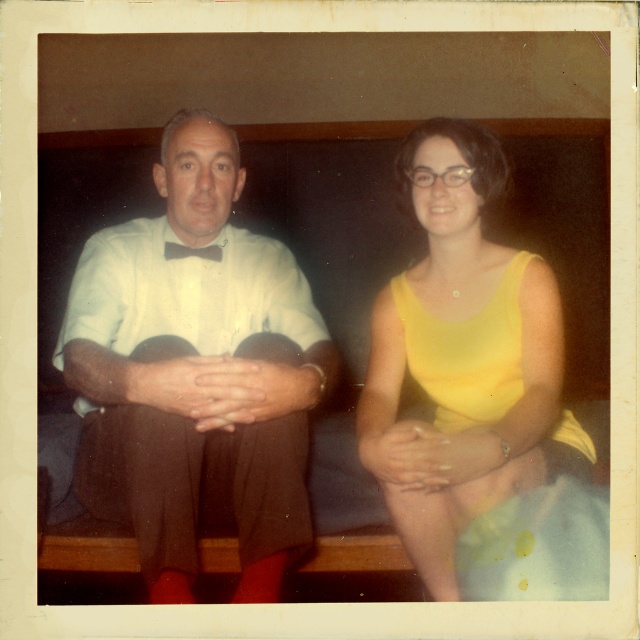
From the picture: You are a photographer trying to replicate this vintage photo. You need to position two mannequins wearing the matte white shirt at center and the yellow matte dress at center. How far apart should you place them to match the original photo?

The matte white shirt at center and yellow matte dress at center should be placed 35.09 centimeters apart to accurately replicate the original photo.

You are a photographer trying to fit both the matte white shirt at center and the yellow matte dress at center into a frame that can only accommodate items up to 1 meter in width. Based on the description, will both items fit within the frame?

The matte white shirt at center might be wider than the yellow matte dress at center. Since the frame can only accommodate items up to 1 meter in width, it is uncertain if both will fit without overlapping or resizing. Further measurements would be needed to confirm.